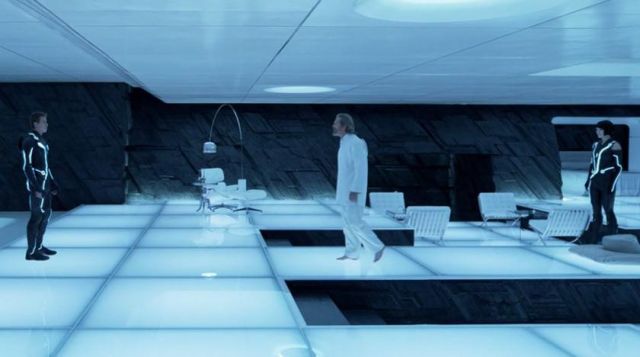
You are a GUI agent. You are given a task and a screenshot of the screen. Output one action in this format:
    pyautogui.click(x=<x>, y=<y>)
    Task: Click on the white ceiling
    
    Given the screenshot: What is the action you would take?
    pyautogui.click(x=292, y=28)